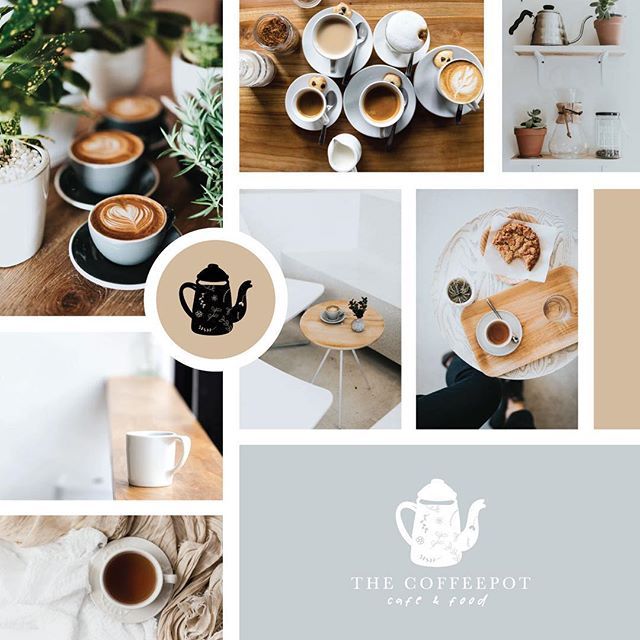
Where is `furniture supports`? The width and height of the screenshot is (640, 640). furniture supports is located at coordinates click(538, 61), click(601, 61), click(534, 164), click(602, 166), click(319, 368), click(340, 377), click(360, 365).